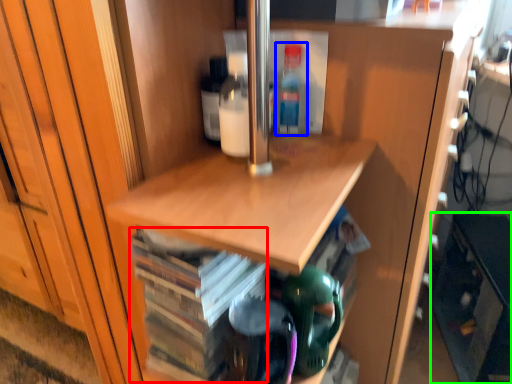
Question: Which object is positioned farthest from book (highlighted by a red box)? Select from bottle (highlighted by a blue box) and cabinetry (highlighted by a green box).

Choices:
 (A) bottle
 (B) cabinetry

Answer: (B)